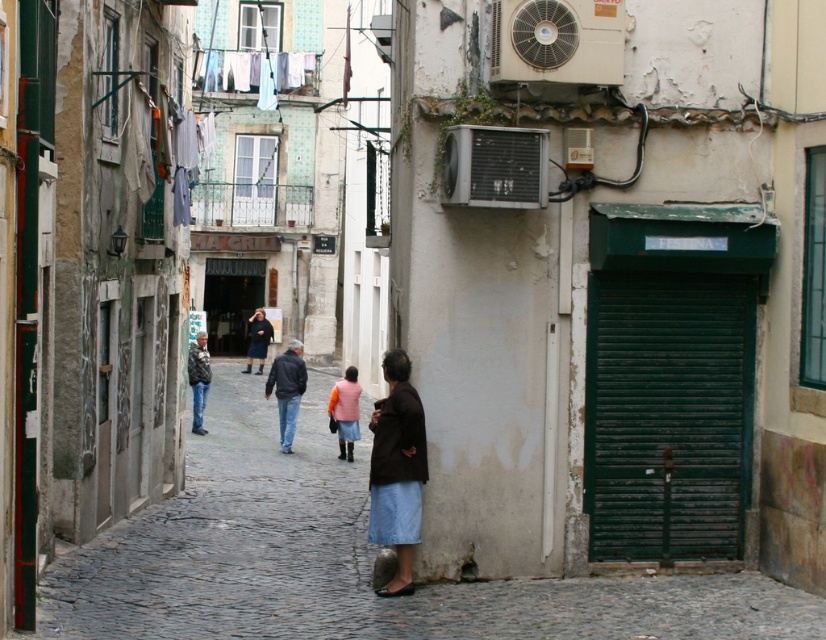
Question: Which of the following is the farthest from the observer?

Choices:
 (A) matte pink vest at center
 (B) dark gray leather jacket at center
 (C) jeans at center
 (D) denim skirt at center

Answer: (B)

Question: Can you confirm if denim skirt at center is thinner than matte pink vest at center?

Choices:
 (A) no
 (B) yes

Answer: (B)

Question: Among these objects, which one is farthest from the camera?

Choices:
 (A) dark blue skirt at center
 (B) dark gray leather jacket at center
 (C) light blue fabric at upper center
 (D) matte pink vest at center

Answer: (C)

Question: Which point is farther to the camera?

Choices:
 (A) (255, 330)
 (B) (198, 410)
 (C) (292, 74)
 (D) (385, 403)

Answer: (C)

Question: Is jeans at center to the left of dark blue skirt at center from the viewer's perspective?

Choices:
 (A) yes
 (B) no

Answer: (B)

Question: Can you confirm if denim skirt at center is positioned to the right of dark gray leather jacket at center?

Choices:
 (A) no
 (B) yes

Answer: (B)